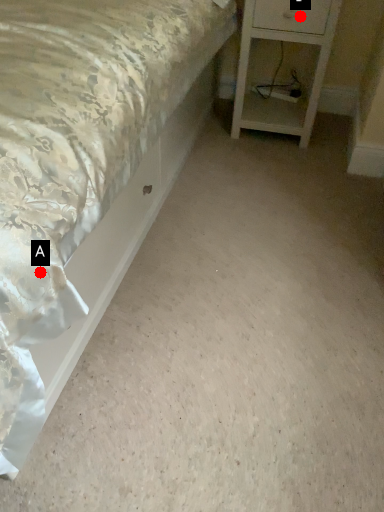
Question: Two points are circled on the image, labeled by A and B beside each circle. Which point is closer to the camera?

Choices:
 (A) A is closer
 (B) B is closer

Answer: (A)